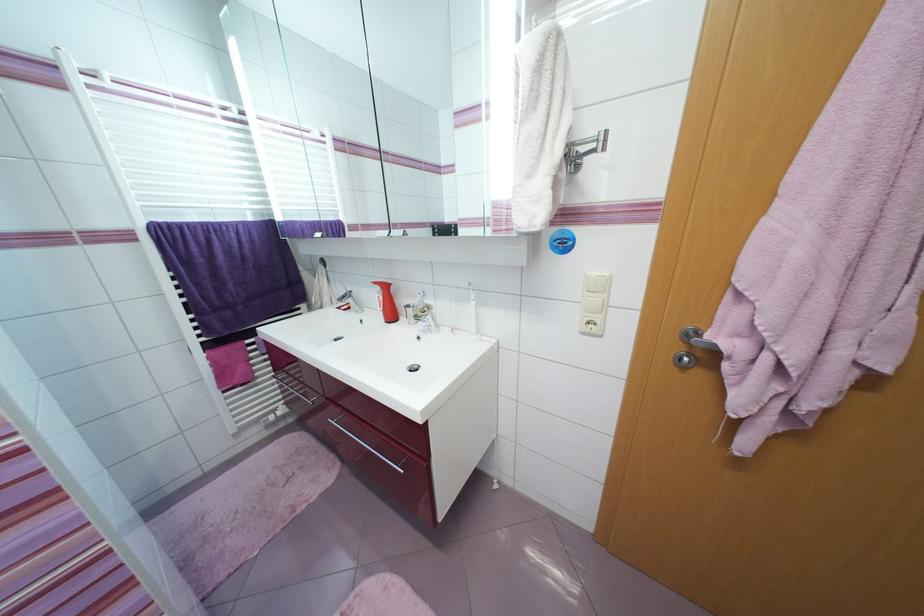
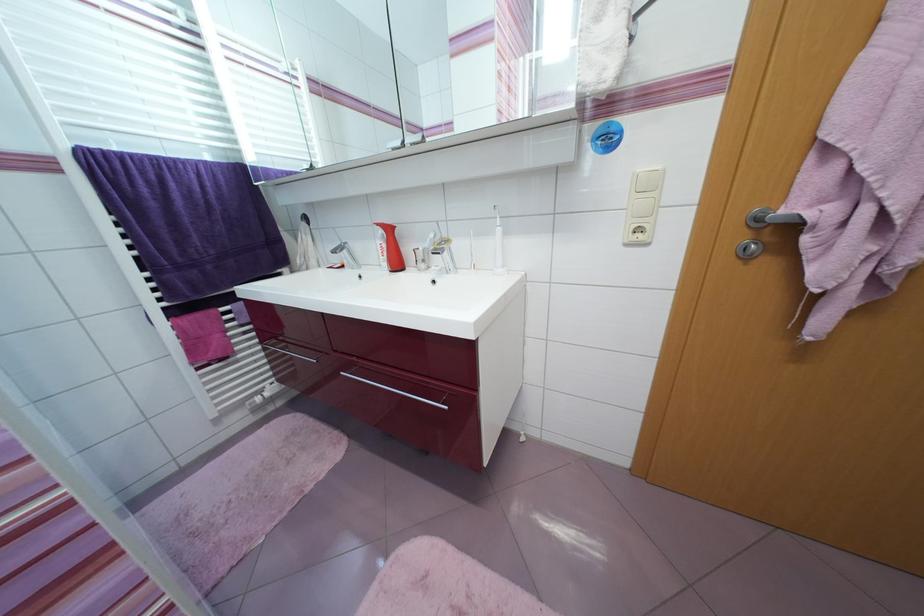
Question: The camera is either moving clockwise (left) or counter-clockwise (right) around the object. The first image is from the beginning of the video and the second image is from the end. Is the camera moving left or right when shooting the video?

Choices:
 (A) Left
 (B) Right

Answer: (A)